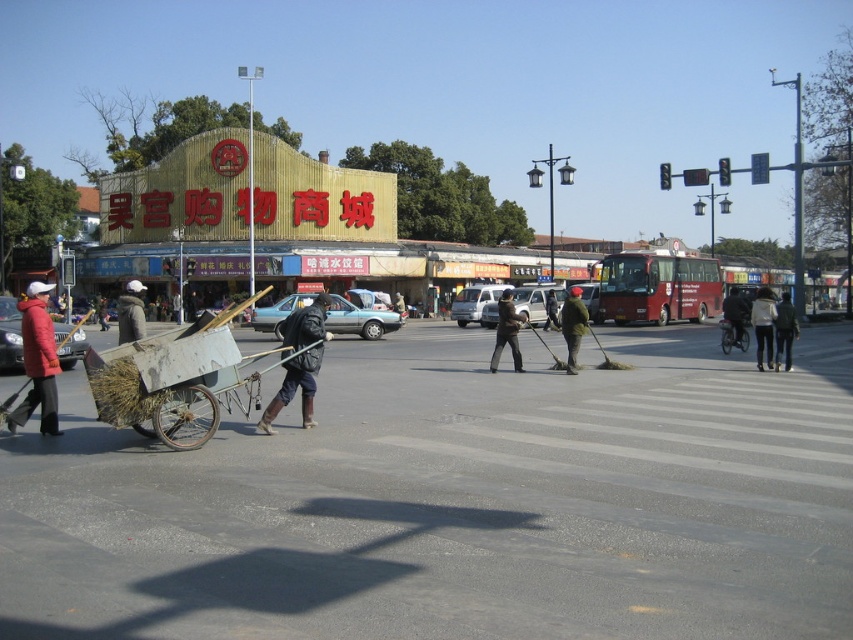
You are a delivery person who needs to pass by the wooden cart at center and the dark gray jacket at crosswalk. Considering their sizes, which one might block your path more?

The wooden cart at center is larger in size than the dark gray jacket at crosswalk, so the wooden cart at center would block your path more.

You are standing at point (181, 384) and want to walk to point (56, 422). Which direction should you move to reach your destination?

You should move backward because point (56, 422) is behind point (181, 384).

You are standing at the point marked by the coordinates point [178,380] in the scene. What object are you standing on?

The point [178,380] corresponds to the wooden cart at center, so you are standing on the wooden cart at center.